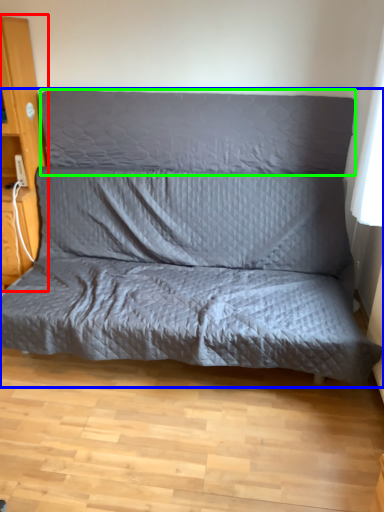
Question: Considering the real-world distances, which object is closest to dresser (highlighted by a red box)? studio couch (highlighted by a blue box) or pillow (highlighted by a green box).

Choices:
 (A) studio couch
 (B) pillow

Answer: (B)